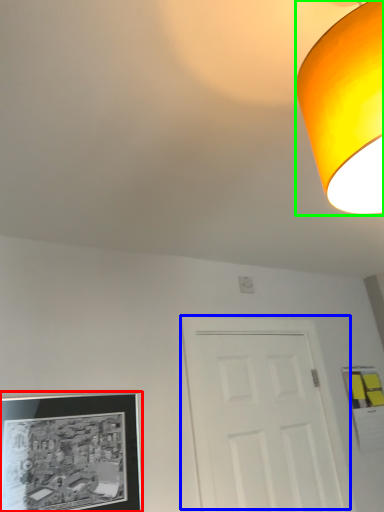
Question: Which object is positioned closest to picture frame (highlighted by a red box)? Select from door (highlighted by a blue box) and lamp (highlighted by a green box).

Choices:
 (A) door
 (B) lamp

Answer: (A)